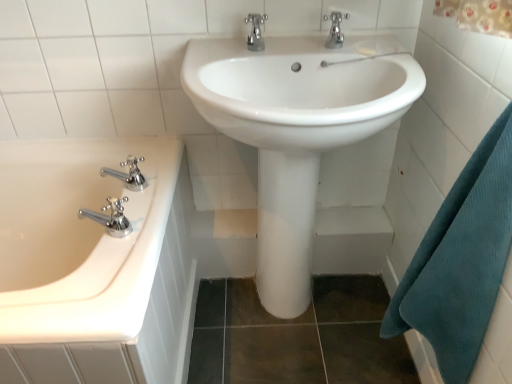
Question: Would you say teal waffle towel at right is to the left or to the right of chrome metallic faucet at left, the fourth tap from the right, in the picture?

Choices:
 (A) left
 (B) right

Answer: (B)

Question: In terms of width, does teal waffle towel at right look wider or thinner when compared to chrome metallic faucet at left, which is the third tap from top to bottom?

Choices:
 (A) wide
 (B) thin

Answer: (A)

Question: Which is farther from the chrome metallic faucet at upper center, placed as the first tap when sorted from right to left?

Choices:
 (A) chrome metallic faucet at upper center, positioned as the second tap in right-to-left order
 (B) chrome/metallic faucet at left, acting as the 2th tap starting from the left
 (C) white glossy sink at center
 (D) white glossy bathtub at left
 (E) teal waffle towel at right

Answer: (D)

Question: Which of these objects is positioned closest to the chrome metallic faucet at left, the 2th tap in the bottom-to-top sequence?

Choices:
 (A) chrome/metallic faucet at left, placed as the 4th tap when sorted from top to bottom
 (B) chrome metallic faucet at upper center, which appears as the 4th tap when viewed from the left
 (C) teal waffle towel at right
 (D) chrome metallic faucet at upper center, which appears as the third tap when ordered from the bottom
 (E) white glossy bathtub at left

Answer: (A)